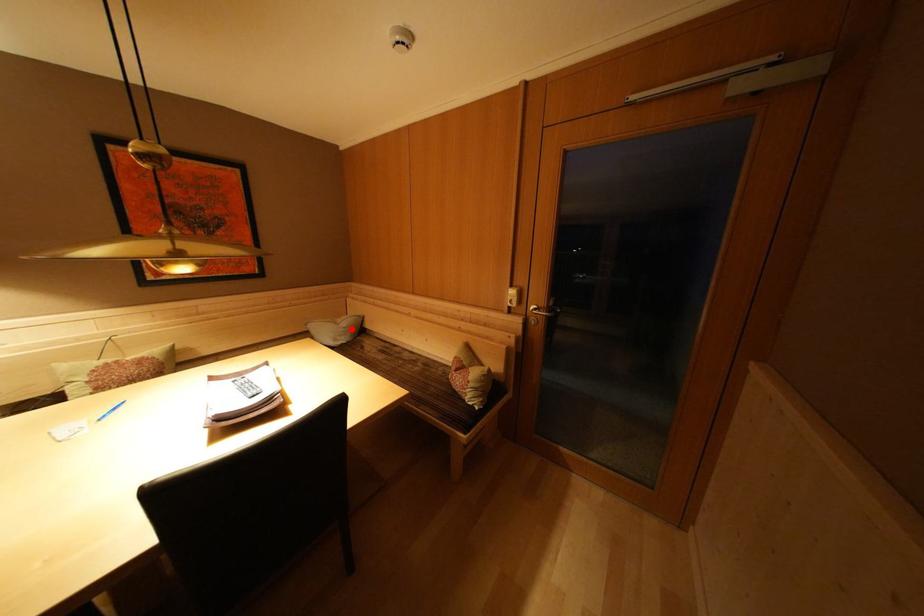
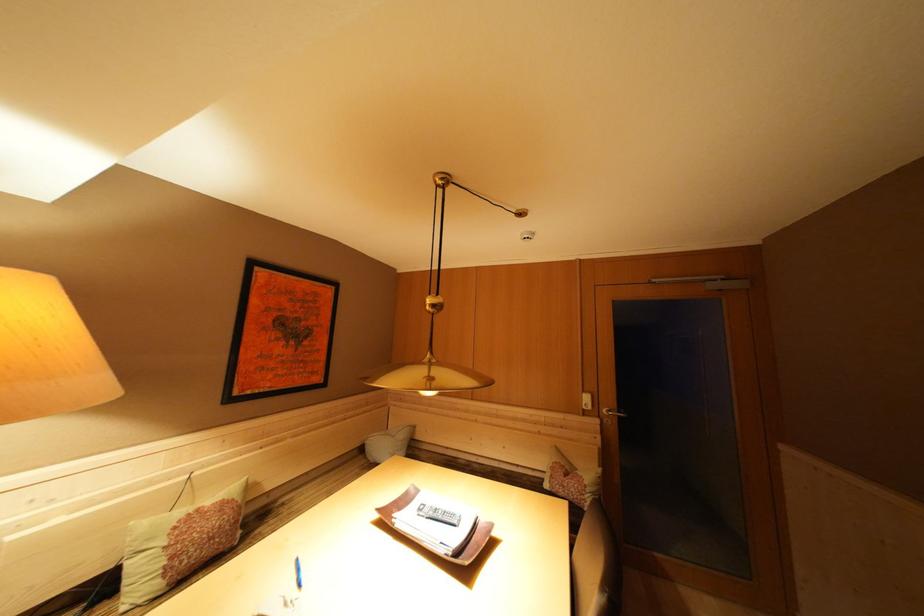
Where in the second image is the point corresponding to the highlighted location from the first image?

(408, 440)